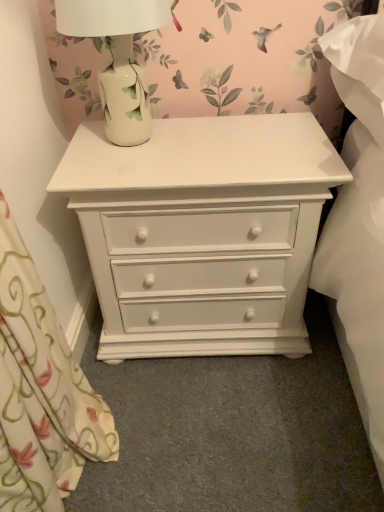
Question: From a real-world perspective, is white ceramic lamp at upper left physically located above or below white painted wood chest of drawers at center?

Choices:
 (A) below
 (B) above

Answer: (B)

Question: Is white ceramic lamp at upper left taller or shorter than white painted wood chest of drawers at center?

Choices:
 (A) short
 (B) tall

Answer: (A)

Question: Would you say white ceramic lamp at upper left is inside or outside white painted wood chest of drawers at center?

Choices:
 (A) inside
 (B) outside

Answer: (B)

Question: Looking at the image, does white painted wood chest of drawers at center seem bigger or smaller compared to white ceramic lamp at upper left?

Choices:
 (A) small
 (B) big

Answer: (B)

Question: Is white painted wood chest of drawers at center in front of or behind white ceramic lamp at upper left in the image?

Choices:
 (A) front
 (B) behind

Answer: (B)

Question: Does point (200, 219) appear closer or farther from the camera than point (150, 26)?

Choices:
 (A) closer
 (B) farther

Answer: (B)

Question: In the image, is white painted wood chest of drawers at center on the left side or the right side of white ceramic lamp at upper left?

Choices:
 (A) right
 (B) left

Answer: (A)